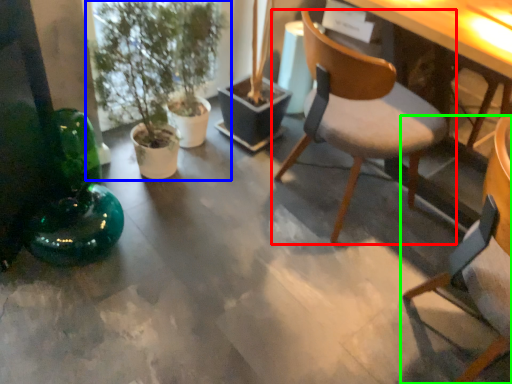
Question: Considering the real-world distances, which object is farthest from chair (highlighted by a red box)? houseplant (highlighted by a blue box) or chair (highlighted by a green box)?

Choices:
 (A) houseplant
 (B) chair

Answer: (A)